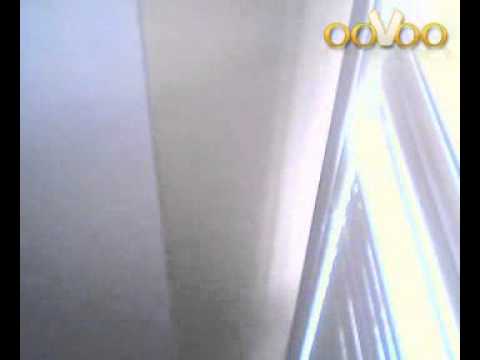
This screenshot has height=360, width=480. I want to click on window, so click(412, 275).